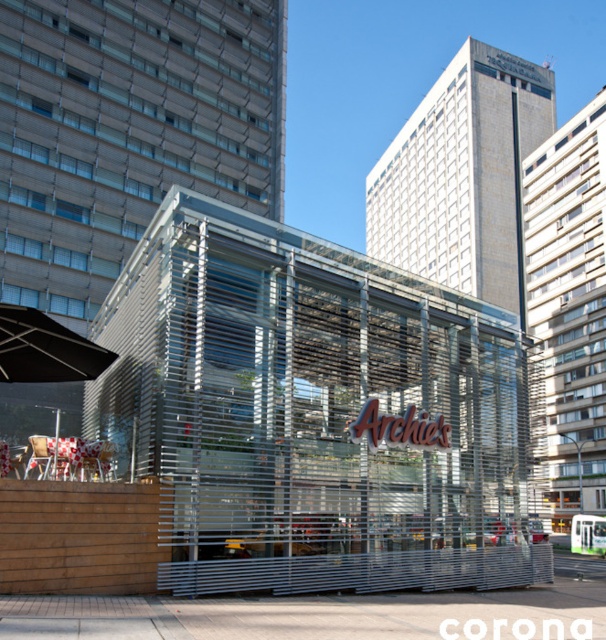
Question: Which point is farther from the camera taking this photo?

Choices:
 (A) (104, 476)
 (B) (30, 372)

Answer: (B)

Question: Is black matte umbrella at left to the right of metallic silver chair at lower left from the viewer's perspective?

Choices:
 (A) no
 (B) yes

Answer: (A)

Question: Does metallic silver chair at lower left appear on the right side of white glossy chair at lower left?

Choices:
 (A) no
 (B) yes

Answer: (A)

Question: Which is farther from the white glossy chair at lower left?

Choices:
 (A) black matte umbrella at left
 (B) metallic silver chair at lower left

Answer: (A)

Question: Which point is closer to the camera?

Choices:
 (A) black matte umbrella at left
 (B) metallic silver chair at lower left
 (C) white glossy chair at lower left

Answer: (A)

Question: Does black matte umbrella at left appear under white glossy chair at lower left?

Choices:
 (A) no
 (B) yes

Answer: (A)